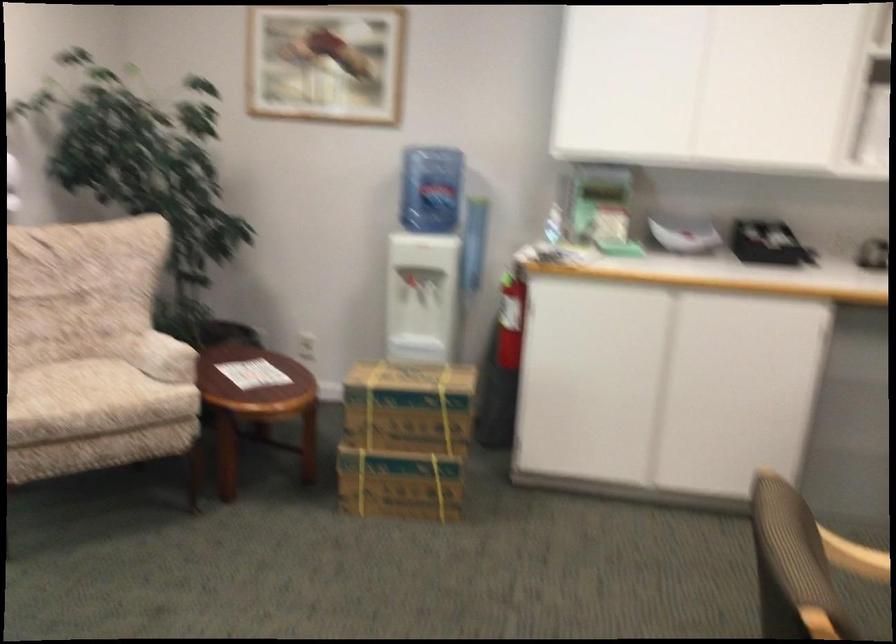
This screenshot has width=896, height=644. Describe the element at coordinates (764, 242) in the screenshot. I see `a black telephone handset` at that location.